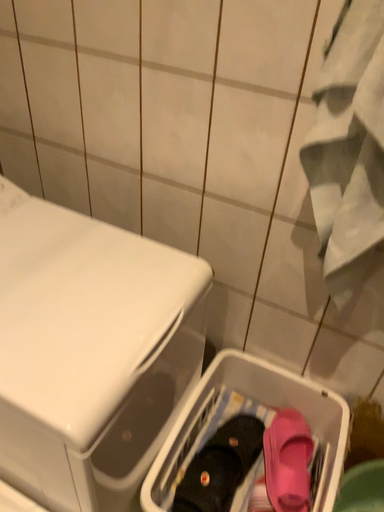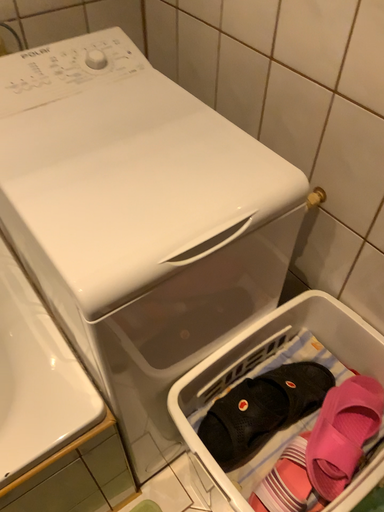
Question: How did the camera likely rotate when shooting the video?

Choices:
 (A) rotated left
 (B) rotated right

Answer: (A)